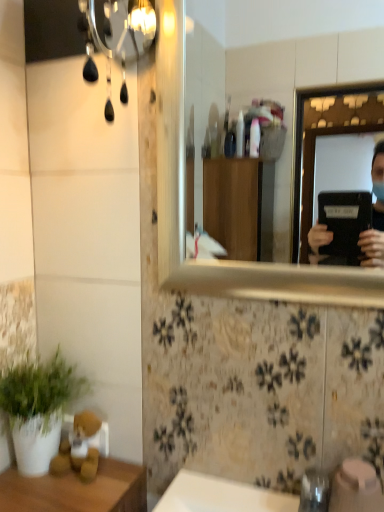
Question: Is metallic silver mirror at upper right in front of or behind white matte plant at lower left in the image?

Choices:
 (A) behind
 (B) front

Answer: (B)

Question: Based on their sizes in the image, would you say metallic silver mirror at upper right is bigger or smaller than white matte plant at lower left?

Choices:
 (A) big
 (B) small

Answer: (A)

Question: From their relative heights in the image, would you say metallic silver mirror at upper right is taller or shorter than white matte plant at lower left?

Choices:
 (A) tall
 (B) short

Answer: (A)

Question: From a real-world perspective, is white matte plant at lower left physically located above or below metallic silver mirror at upper right?

Choices:
 (A) above
 (B) below

Answer: (B)

Question: Would you say white matte plant at lower left is to the left or to the right of metallic silver mirror at upper right in the picture?

Choices:
 (A) right
 (B) left

Answer: (B)

Question: Relative to metallic silver mirror at upper right, is white matte plant at lower left in front or behind?

Choices:
 (A) front
 (B) behind

Answer: (B)

Question: Looking at their shapes, would you say white matte plant at lower left is wider or thinner than metallic silver mirror at upper right?

Choices:
 (A) wide
 (B) thin

Answer: (A)